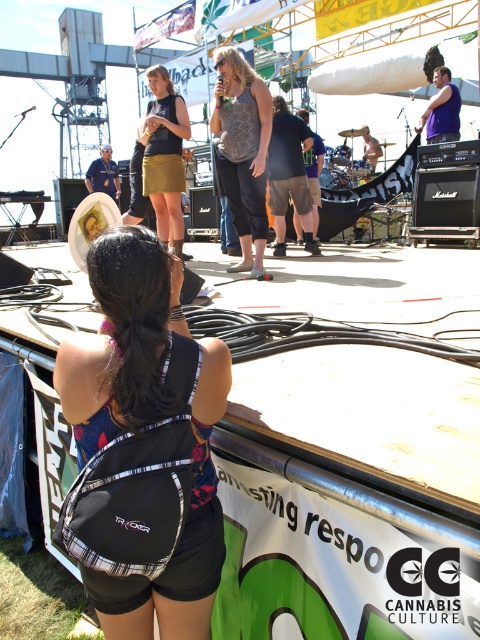
Question: Is black fabric backpack at center below textured gray tank top at center?

Choices:
 (A) yes
 (B) no

Answer: (A)

Question: Which of the following is the farthest from the observer?

Choices:
 (A) gold skirt at center
 (B) black fabric backpack at center
 (C) textured gray tank top at center

Answer: (A)

Question: Which point is closer to the camera taking this photo?

Choices:
 (A) pos(206,492)
 (B) pos(154,177)

Answer: (A)

Question: Is black fabric backpack at center above textured gray tank top at center?

Choices:
 (A) yes
 (B) no

Answer: (B)

Question: Does textured gray tank top at center appear over gold skirt at center?

Choices:
 (A) no
 (B) yes

Answer: (A)

Question: Which point is farther to the camera?

Choices:
 (A) gold skirt at center
 (B) textured gray tank top at center
 (C) black fabric backpack at center

Answer: (A)